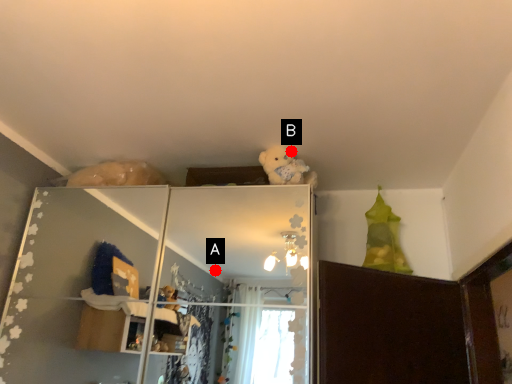
Question: Two points are circled on the image, labeled by A and B beside each circle. Which point is farther from the camera taking this photo?

Choices:
 (A) A is further
 (B) B is further

Answer: (A)